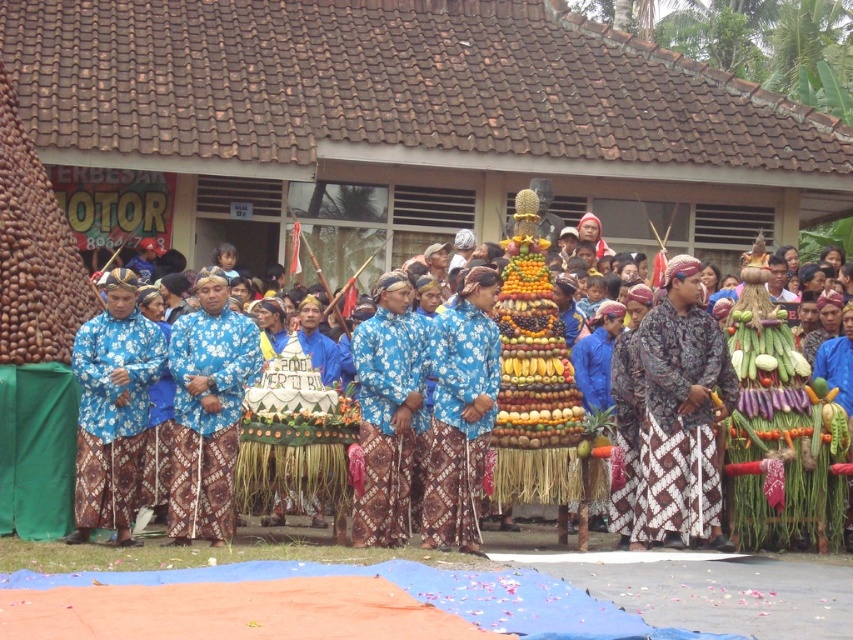
You need to cover a rectangular table that is 1.5 meters wide with either the blue batik fabric at center or the blue batik cloth at center. Based on their sizes, which one would you choose?

The blue batik fabric at center might be wider than blue batik cloth at center, so it is more likely to cover the 1.5 meters wide table.

You are standing at a distance of 50 meters from the point marked as point [550,401]. Can you reach it without moving closer?

The distance of point [550,401] from viewer is 44.79 meters, so yes, you can reach it without moving closer since it is within the 50 meters distance.

You are a photographer standing at the event, and you want to take a closeup shot of the blue batik fabric at center. Considering the distance, can you capture it clearly without moving closer?

The blue batik fabric at center is 138.73 feet away from camera. At this distance, capturing a clear closeup shot without moving closer would be challenging as the subject is too far away.